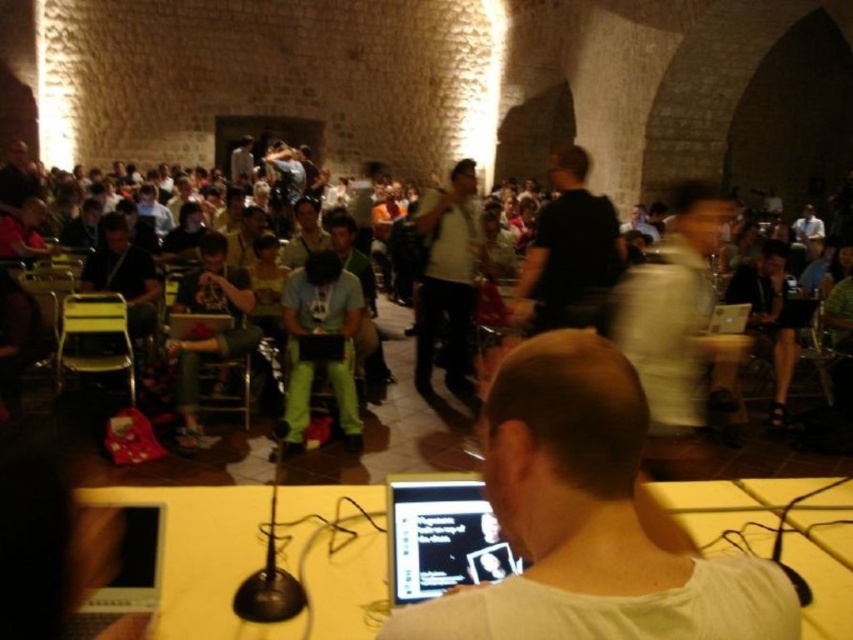
You are attending a conference in a historic building and see the black matte shirt at center and the black glossy laptop at lower center. Which object is located higher in the image?

The black matte shirt at center is above the black glossy laptop at lower center, so the black matte shirt at center is higher in the image.

You are organizing a small meeting and need to place a white plastic table at center and green fabric chairs at center in a way that accommodates all attendees comfortably. Given their sizes, which object should you place first to ensure there is enough space for both?

The white plastic table at center has a smaller size compared to green fabric chairs at center. Therefore, you should place the green fabric chairs at center first to ensure there is enough space for the larger chairs before positioning the smaller table.

You are standing in the conference room and want to move from point A to point B. Point A is at coordinate point(x=543, y=248) and point B is at coordinate point(x=471, y=534). Which point is closer to you?

Point A at coordinate point(x=543, y=248) is closer to you than point B at coordinate point(x=471, y=534) because it is further to the camera.